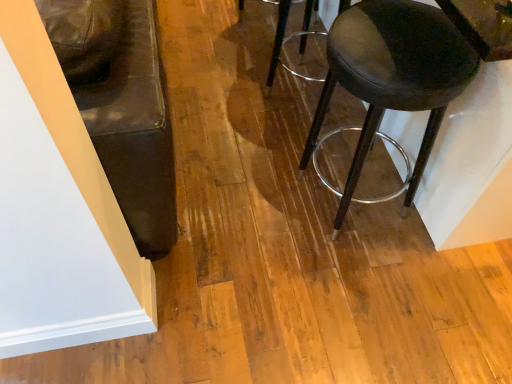
The height and width of the screenshot is (384, 512). What are the coordinates of `free space to the left of matte black stool at right, which ranks as the 2th stool in top-to-bottom order` in the screenshot? It's located at (255, 197).